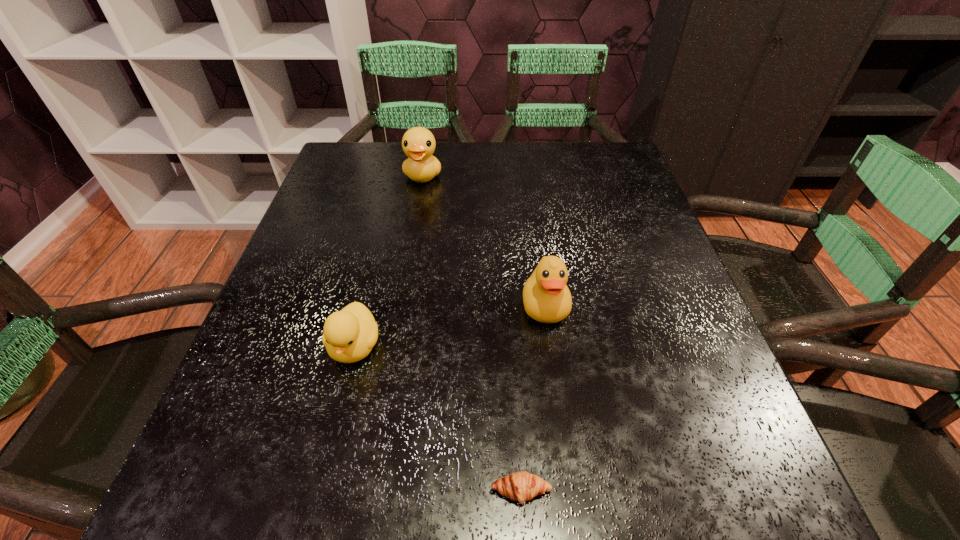
Locate an element on the screen. The height and width of the screenshot is (540, 960). object at the left edge is located at coordinates (349, 335).

In order to click on vacant point at the far edge in this screenshot , I will do `click(459, 172)`.

The width and height of the screenshot is (960, 540). In order to click on vacant area at the left edge of the desktop in this screenshot , I will do `click(294, 342)`.

Locate an element on the screen. The height and width of the screenshot is (540, 960). vacant space at the right edge of the desktop is located at coordinates (645, 271).

Locate an element on the screen. This screenshot has height=540, width=960. free location at the far left corner is located at coordinates (357, 145).

The height and width of the screenshot is (540, 960). What are the coordinates of `vacant space at the near right corner of the desktop` in the screenshot? It's located at (728, 473).

Find the location of a particular element. This screenshot has height=540, width=960. empty location between the nearest object and the shortest duck is located at coordinates (x=438, y=418).

Where is `free point between the farthest duck and the second shortest object`? Image resolution: width=960 pixels, height=540 pixels. free point between the farthest duck and the second shortest object is located at coordinates (389, 261).

Locate an element on the screen. The width and height of the screenshot is (960, 540). free point between the farthest object and the third tallest object is located at coordinates (389, 261).

Where is `vacant region between the third tallest object and the rightmost duck`? Image resolution: width=960 pixels, height=540 pixels. vacant region between the third tallest object and the rightmost duck is located at coordinates (450, 326).